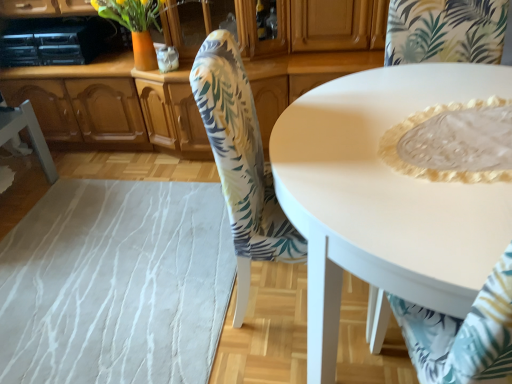
Question: Is wooden cabinet at center thinner than white lace tablecloth at lower right, the third chair in the left-to-right sequence?

Choices:
 (A) yes
 (B) no

Answer: (B)

Question: Does wooden cabinet at center appear on the left side of white lace tablecloth at lower right, the third chair in the left-to-right sequence?

Choices:
 (A) yes
 (B) no

Answer: (A)

Question: Is wooden cabinet at center beside white lace tablecloth at lower right, the third chair in the left-to-right sequence?

Choices:
 (A) no
 (B) yes

Answer: (A)

Question: Does wooden cabinet at center appear on the right side of white lace tablecloth at lower right, the third chair in the left-to-right sequence?

Choices:
 (A) yes
 (B) no

Answer: (B)

Question: Considering the relative sizes of wooden cabinet at center and white lace tablecloth at lower right, the third chair in the left-to-right sequence, in the image provided, is wooden cabinet at center smaller than white lace tablecloth at lower right, the third chair in the left-to-right sequence,?

Choices:
 (A) yes
 (B) no

Answer: (B)

Question: In terms of height, does white fabric chair at lower left, which is the first chair in left-to-right order, look taller or shorter compared to wooden cabinet at center?

Choices:
 (A) short
 (B) tall

Answer: (A)

Question: Would you say white fabric chair at lower left, placed as the 3th chair when sorted from right to left, is to the left or to the right of wooden cabinet at center in the picture?

Choices:
 (A) left
 (B) right

Answer: (A)

Question: Is white fabric chair at lower left, placed as the 3th chair when sorted from right to left, in front of or behind wooden cabinet at center in the image?

Choices:
 (A) behind
 (B) front

Answer: (B)

Question: From the image's perspective, is white fabric chair at lower left, placed as the 3th chair when sorted from right to left, above or below wooden cabinet at center?

Choices:
 (A) below
 (B) above

Answer: (A)

Question: Considering the positions of white glossy table at center and white lace tablecloth at lower right, the third chair in the left-to-right sequence, in the image, is white glossy table at center bigger or smaller than white lace tablecloth at lower right, the third chair in the left-to-right sequence,?

Choices:
 (A) big
 (B) small

Answer: (A)

Question: Relative to white lace tablecloth at lower right, which ranks as the first chair in right-to-left order, is white glossy table at center in front or behind?

Choices:
 (A) front
 (B) behind

Answer: (B)

Question: From the image's perspective, is white glossy table at center positioned above or below white lace tablecloth at lower right, the third chair in the left-to-right sequence?

Choices:
 (A) above
 (B) below

Answer: (A)

Question: Considering the relative positions of white glossy table at center and white lace tablecloth at lower right, which ranks as the first chair in right-to-left order, in the image provided, is white glossy table at center to the left or to the right of white lace tablecloth at lower right, which ranks as the first chair in right-to-left order,?

Choices:
 (A) left
 (B) right

Answer: (B)

Question: Is white fabric chair at lower left, which is the first chair in left-to-right order, wider or thinner than white glossy table at center?

Choices:
 (A) wide
 (B) thin

Answer: (B)

Question: From the image's perspective, relative to white glossy table at center, is white fabric chair at lower left, which is the first chair in left-to-right order, above or below?

Choices:
 (A) below
 (B) above

Answer: (B)